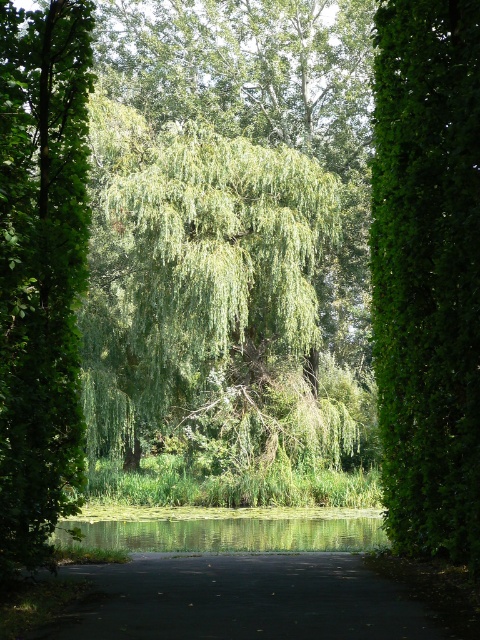
Can you confirm if green leafy willow at center is smaller than green leafy tree at left?

Incorrect, green leafy willow at center is not smaller in size than green leafy tree at left.

Between point (284, 308) and point (52, 131), which one is positioned behind?

The point (284, 308) is behind.

Who is more forward, (x=248, y=205) or (x=39, y=156)?

Point (x=39, y=156) is more forward.

Identify the location of green leafy willow at center. [x=200, y=284].

Does green leafy hedge at right have a greater width compared to green leafy tree at left?

No.

Can you confirm if green leafy hedge at right is positioned above green leafy tree at left?

Correct, green leafy hedge at right is located above green leafy tree at left.

Find the location of a particular element. The width and height of the screenshot is (480, 640). green leafy hedge at right is located at coordinates (428, 273).

Identify the location of green leafy hedge at right. (428, 273).

Does green leafy hedge at right appear over green reflective water at center?

Correct, green leafy hedge at right is located above green reflective water at center.

Between green leafy hedge at right and green reflective water at center, which one appears on the left side from the viewer's perspective?

Answer: green reflective water at center

Image resolution: width=480 pixels, height=640 pixels. Identify the location of green leafy hedge at right. (428, 273).

You are a GUI agent. You are given a task and a screenshot of the screen. Output one action in this format:
    pyautogui.click(x=<x>, y=<y>)
    Task: Click on the green leafy hedge at right
    This screenshot has width=480, height=640.
    Given the screenshot: What is the action you would take?
    pyautogui.click(x=428, y=273)